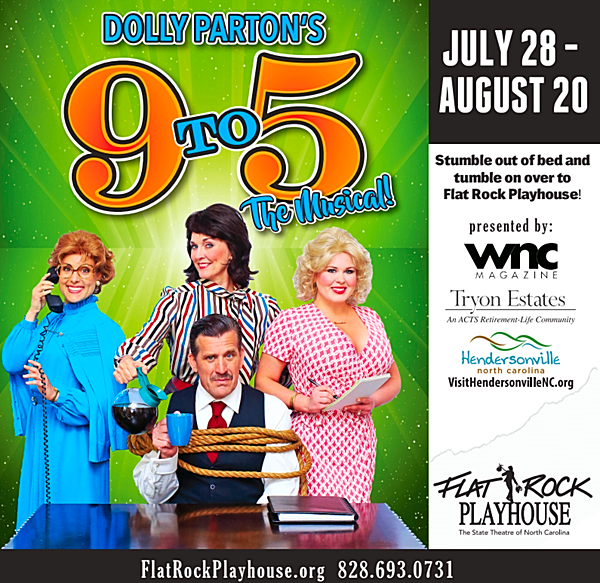
What are the coordinates of `book on right side of table lower right` in the screenshot? It's located at (318, 515).